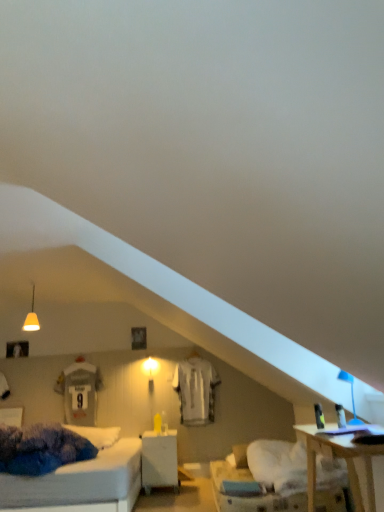
Question: From the image's perspective, does matte white pendant light at upper left appear higher than white jersey at center?

Choices:
 (A) no
 (B) yes

Answer: (B)

Question: Is matte white pendant light at upper left at the left side of white jersey at center?

Choices:
 (A) yes
 (B) no

Answer: (A)

Question: Is matte white pendant light at upper left in contact with white jersey at center?

Choices:
 (A) yes
 (B) no

Answer: (B)

Question: Is matte white pendant light at upper left oriented away from white jersey at center?

Choices:
 (A) yes
 (B) no

Answer: (B)

Question: Is the depth of matte white pendant light at upper left less than that of white jersey at center?

Choices:
 (A) no
 (B) yes

Answer: (B)

Question: From a real-world perspective, is white jersey at center above or below white glossy nightstand at center?

Choices:
 (A) below
 (B) above

Answer: (B)

Question: Considering the positions of point (183, 418) and point (163, 441), is point (183, 418) closer or farther from the camera than point (163, 441)?

Choices:
 (A) farther
 (B) closer

Answer: (A)

Question: Is white jersey at center wider or thinner than white glossy nightstand at center?

Choices:
 (A) thin
 (B) wide

Answer: (A)

Question: In terms of height, does white jersey at center look taller or shorter compared to white glossy nightstand at center?

Choices:
 (A) tall
 (B) short

Answer: (A)

Question: Considering the positions of point (339, 373) and point (34, 321), is point (339, 373) closer or farther from the camera than point (34, 321)?

Choices:
 (A) farther
 (B) closer

Answer: (B)

Question: Is blue plastic table lamp at upper right wider or thinner than matte white pendant light at upper left?

Choices:
 (A) thin
 (B) wide

Answer: (A)

Question: Relative to matte white pendant light at upper left, is blue plastic table lamp at upper right in front or behind?

Choices:
 (A) front
 (B) behind

Answer: (A)

Question: Is blue plastic table lamp at upper right spatially inside matte white pendant light at upper left, or outside of it?

Choices:
 (A) outside
 (B) inside

Answer: (A)

Question: From the image's perspective, is white jersey at center positioned above or below blue plastic table lamp at upper right?

Choices:
 (A) below
 (B) above

Answer: (A)

Question: Is white jersey at center inside or outside of blue plastic table lamp at upper right?

Choices:
 (A) outside
 (B) inside

Answer: (A)